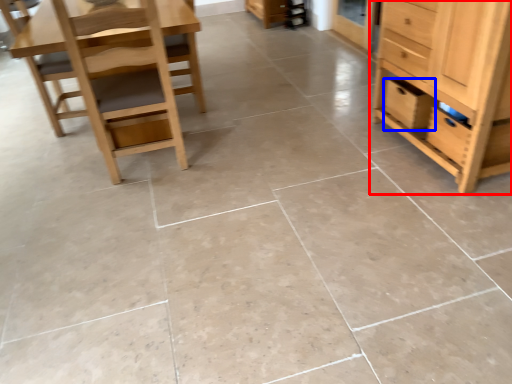
Question: Which of the following is the closest to the observer, chest of drawers (highlighted by a red box) or drawer (highlighted by a blue box)?

Choices:
 (A) chest of drawers
 (B) drawer

Answer: (A)